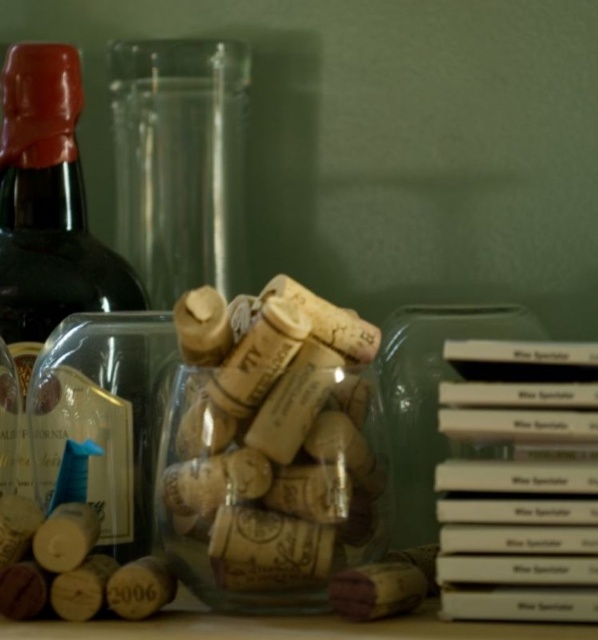
Question: Among these objects, which one is nearest to the camera?

Choices:
 (A) transparent plastic jar at center
 (B) matte dark green bottle at left

Answer: (A)

Question: Considering the relative positions of matte dark green bottle at left and transparent plastic jar at center in the image provided, where is matte dark green bottle at left located with respect to transparent plastic jar at center?

Choices:
 (A) left
 (B) right

Answer: (A)

Question: Which object appears closest to the camera in this image?

Choices:
 (A) transparent plastic jar at center
 (B) matte dark green bottle at left

Answer: (A)

Question: Is matte dark green bottle at left to the right of transparent plastic jar at center from the viewer's perspective?

Choices:
 (A) no
 (B) yes

Answer: (A)

Question: Can you confirm if matte dark green bottle at left is smaller than transparent plastic jar at center?

Choices:
 (A) yes
 (B) no

Answer: (A)